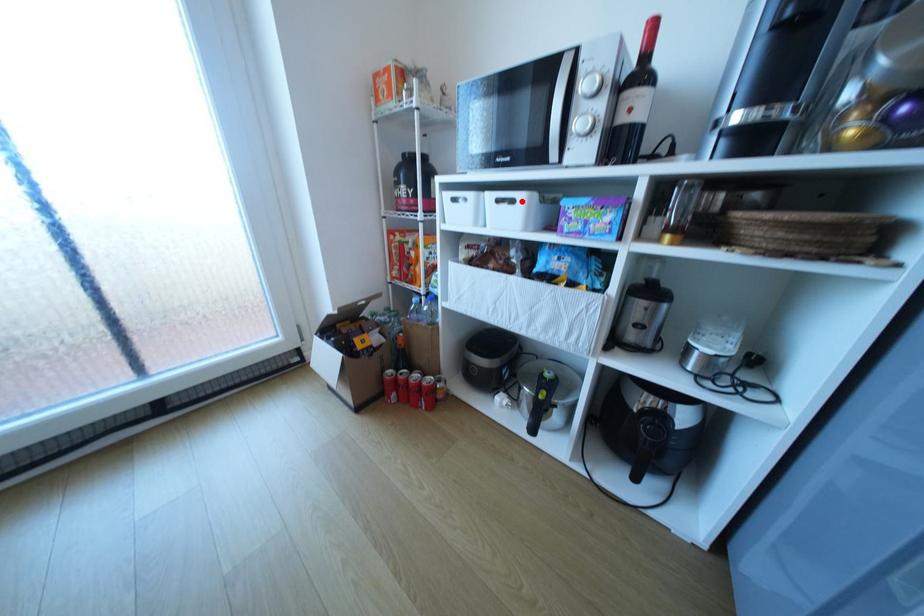
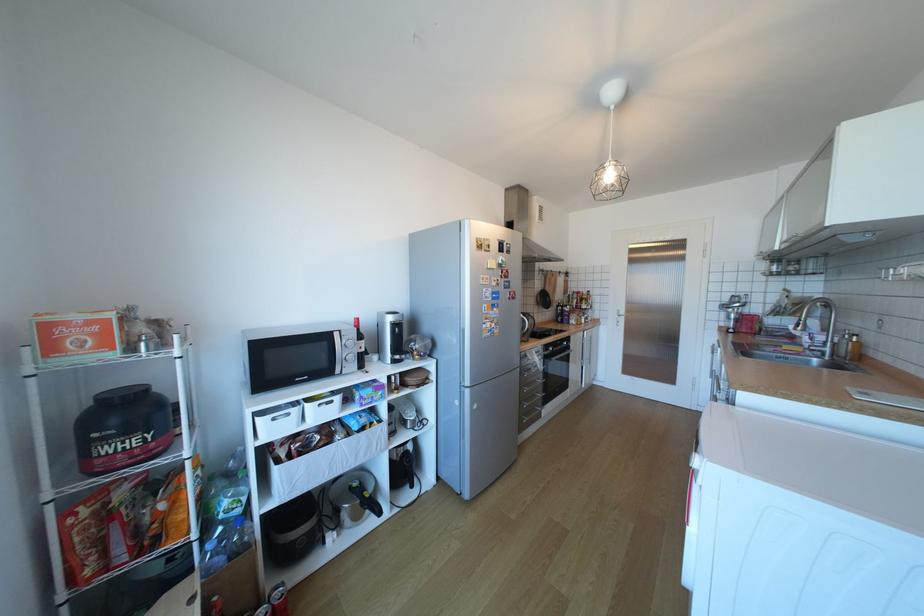
Question: I am providing you with two images of the same scene from different viewpoints. In image1, a red point is highlighted. Considering the same 3D point in image2, which of the following is correct?

Choices:
 (A) It is closer
 (B) It is farther

Answer: (B)